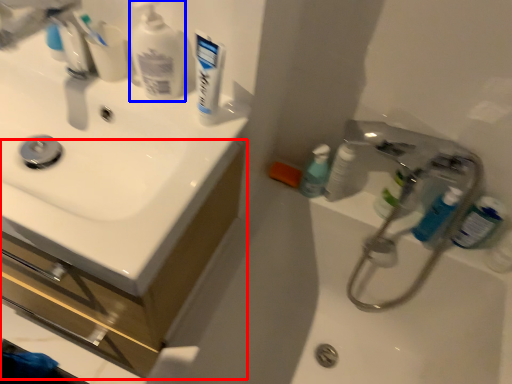
Question: Which point is closer to the camera, bathroom cabinet (highlighted by a red box) or cleaning product (highlighted by a blue box)?

Choices:
 (A) bathroom cabinet
 (B) cleaning product

Answer: (B)